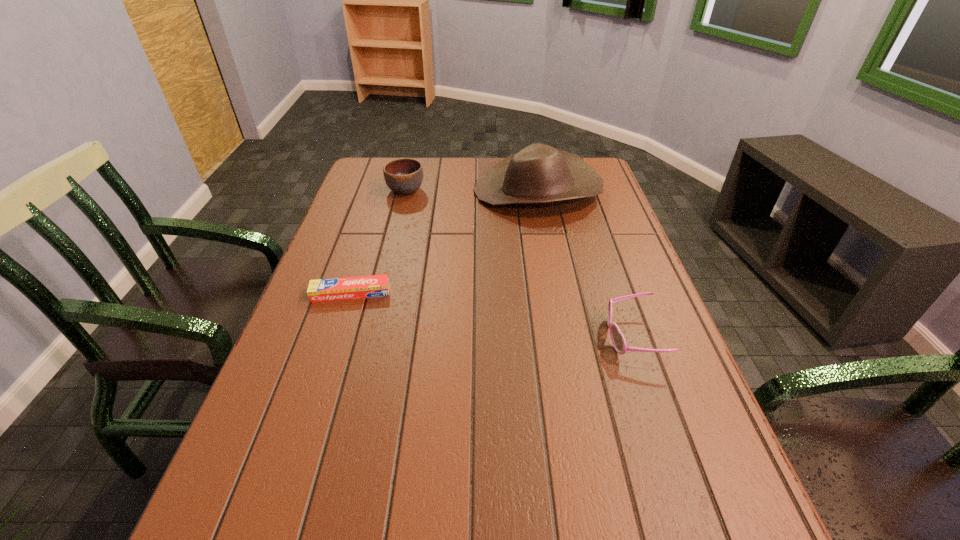
The image size is (960, 540). In order to click on object that stands as the second closest to the cowboy hat in this screenshot , I will do (344, 288).

At what (x,y) coordinates should I click in order to perform the action: click on vacant point that satisfies the following two spatial constraints: 1. on the back side of the shortest object; 2. on the right side of the tallest object. Please return your answer as a coordinate pair (x, y). Looking at the image, I should click on click(x=384, y=191).